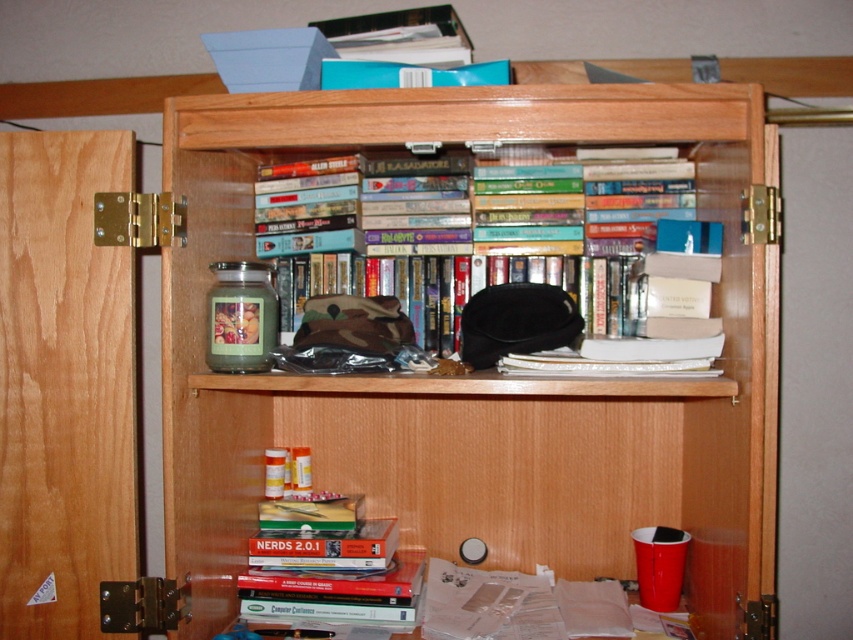
Question: Can you confirm if wooden bookshelf at upper center is positioned to the left of hardcover books at upper center?

Choices:
 (A) no
 (B) yes

Answer: (B)

Question: Can you confirm if wooden bookshelf at upper center is positioned above hardcover books at upper center?

Choices:
 (A) no
 (B) yes

Answer: (A)

Question: Considering the relative positions of wooden bookshelf at upper center and hardcover books at upper center in the image provided, where is wooden bookshelf at upper center located with respect to hardcover books at upper center?

Choices:
 (A) below
 (B) above

Answer: (A)

Question: Which of the following is the closest to the observer?

Choices:
 (A) (347, 310)
 (B) (703, 138)

Answer: (B)